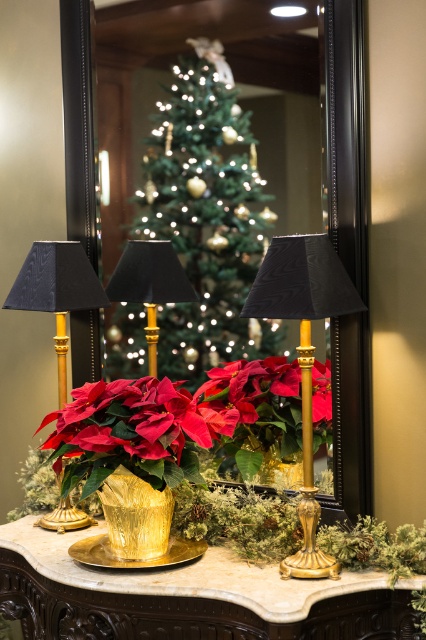
You are setting up a holiday display and need to place a 12 inch wide decorative box between the green textured christmas tree at center and the matte gold pot at center. Will there be enough space to fit the box between them?

The green textured christmas tree at center and matte gold pot at center are 16.07 inches apart, so yes, the 12 inch wide decorative box will fit between them since the space is wider than the box.

From the picture: You are planning to place a new decoration on the table. The decoration requires a surface area larger than the matte gold pot at center. Can the green textured christmas tree at center provide enough space for this decoration?

The green textured christmas tree at center is bigger than the matte gold pot at center, so it can provide enough space for the decoration that requires a larger surface area than the matte gold pot at center.

You are a decorator trying to place a new 1.5 meter tall artificial tree in the space where the green textured christmas tree at center currently stands. The gold textured table at center is 0.8 meters tall. Will the new tree fit in the space without exceeding the height of the table?

The green textured christmas tree at center is taller than the gold textured table at center. Since the new tree is 1.5 meters tall and the table is 0.8 meters tall, the new tree will exceed the table height and not fit without being too tall.